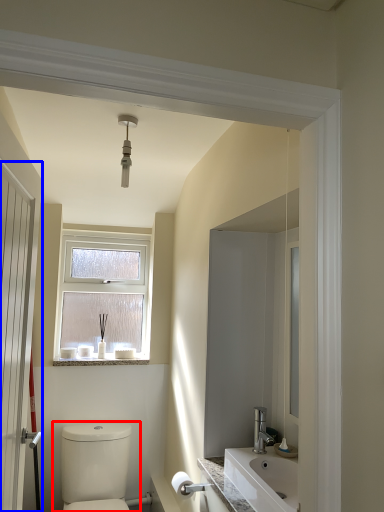
Question: Which of the following is the farthest to the observer, toilet (highlighted by a red box) or door (highlighted by a blue box)?

Choices:
 (A) toilet
 (B) door

Answer: (A)